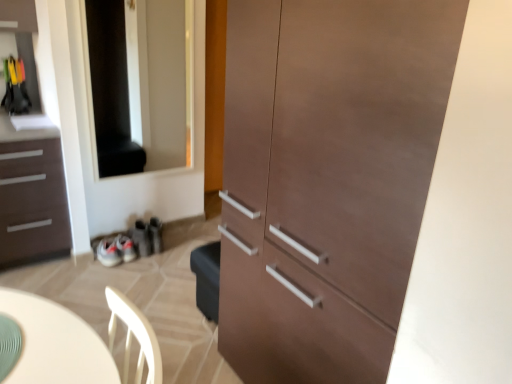
This screenshot has height=384, width=512. What do you see at coordinates (327, 179) in the screenshot?
I see `brown matte cabinet at right` at bounding box center [327, 179].

At what (x,y) coordinates should I click in order to perform the action: click on brown matte cabinet at right. Please return your answer as a coordinate pair (x, y). This screenshot has height=384, width=512. Looking at the image, I should click on (327, 179).

What is the approximate height of brown matte cabinet at right?

brown matte cabinet at right is 1.61 meters tall.

Locate an element on the screen. This screenshot has height=384, width=512. brown matte cabinet at right is located at coordinates (x=327, y=179).